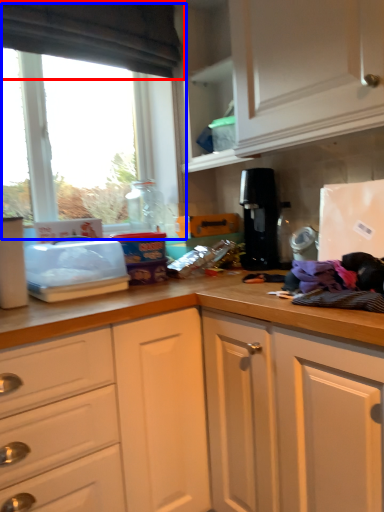
Question: Which point is further to the camera, exhaust hood (highlighted by a red box) or window (highlighted by a blue box)?

Choices:
 (A) exhaust hood
 (B) window

Answer: (B)